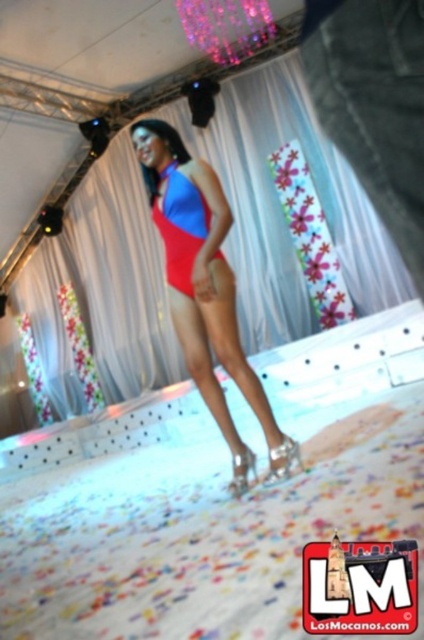
Is matte red swimsuit at upper center below matte red swimsuit at center?

No, matte red swimsuit at upper center is not below matte red swimsuit at center.

Does matte red swimsuit at upper center come in front of matte red swimsuit at center?

Yes, matte red swimsuit at upper center is in front of matte red swimsuit at center.

Is point (421, 24) positioned after point (144, 179)?

That is False.

Find the location of `matte red swimsuit at upper center`. matte red swimsuit at upper center is located at coordinates (373, 104).

Who is higher up, matte red swimsuit at upper center or matte blue bikini top at center?

Positioned higher is matte blue bikini top at center.

Does matte red swimsuit at upper center have a greater width compared to matte blue bikini top at center?

In fact, matte red swimsuit at upper center might be narrower than matte blue bikini top at center.

Who is more forward, (410, 102) or (189, 285)?

Point (410, 102) is in front.

At what (x,y) coordinates should I click in order to perform the action: click on matte red swimsuit at upper center. Please return your answer as a coordinate pair (x, y). Looking at the image, I should click on (373, 104).

Who is lower down, white sheer curtain at center or matte blue bikini top at center?

white sheer curtain at center is below.

Is white sheer curtain at center thinner than matte blue bikini top at center?

Yes, white sheer curtain at center is thinner than matte blue bikini top at center.

Is point (100, 371) farther from camera compared to point (164, 216)?

Yes, point (100, 371) is farther from viewer.

You are a GUI agent. You are given a task and a screenshot of the screen. Output one action in this format:
    pyautogui.click(x=<x>, y=<y>)
    Task: Click on the white sheer curtain at center
    Image resolution: width=424 pixels, height=640 pixels.
    Given the screenshot: What is the action you would take?
    pyautogui.click(x=281, y=209)